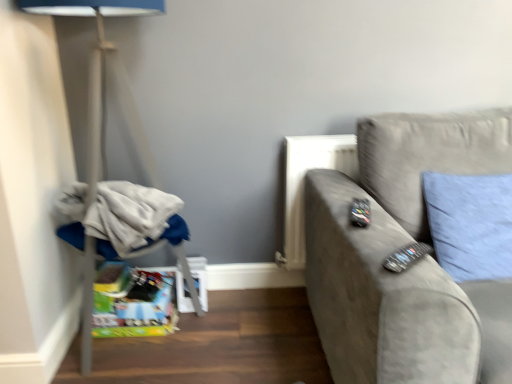
Question: From a real-world perspective, is white fabric at left above or below black plastic remote at right, arranged as the 1th remote when ordered from the bottom?

Choices:
 (A) above
 (B) below

Answer: (B)

Question: Based on their sizes in the image, would you say white fabric at left is bigger or smaller than black plastic remote at right, which is the 2th remote from back to front?

Choices:
 (A) big
 (B) small

Answer: (A)

Question: Estimate the real-world distances between objects in this image. Which object is closer to the suede gray couch at right?

Choices:
 (A) black plastic remote at right, which is the 2th remote from back to front
 (B) black plastic remote at right, acting as the 1th remote starting from the top
 (C) white fabric at left
 (D) blue fabric pillow at right
 (E) matte gray lamp at left

Answer: (D)

Question: Based on their relative distances, which object is nearer to the suede gray couch at right?

Choices:
 (A) blue fabric pillow at right
 (B) white fabric at left
 (C) black plastic remote at right, positioned as the 1th remote in front-to-back order
 (D) black plastic remote at right, the first remote in the back-to-front sequence
 (E) matte gray lamp at left

Answer: (A)